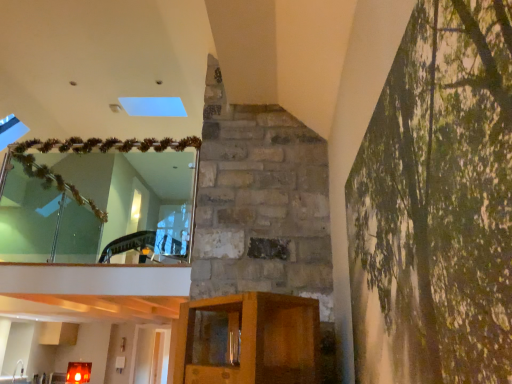
Image resolution: width=512 pixels, height=384 pixels. I want to click on clear glass mirror at upper left, so click(x=98, y=200).

Identify the location of brushed metal sink at lower left. The height and width of the screenshot is (384, 512). (16, 375).

Image resolution: width=512 pixels, height=384 pixels. I want to click on tree below the clear glass mirror at upper left (from the image's perspective), so click(x=437, y=204).

From the image's perspective, is clear glass mirror at upper left above or below green textured canvas at right?

clear glass mirror at upper left is above green textured canvas at right.

Is clear glass mirror at upper left touching green textured canvas at right?

No, clear glass mirror at upper left is not making contact with green textured canvas at right.

Considering the sizes of objects clear glass mirror at upper left and green textured canvas at right in the image provided, who is wider, clear glass mirror at upper left or green textured canvas at right?

clear glass mirror at upper left is wider.

Which of these two, green textured canvas at right or brushed metal sink at lower left, is thinner?

With smaller width is green textured canvas at right.

In the scene shown: How different are the orientations of green textured canvas at right and brushed metal sink at lower left in degrees?

The angle between the facing direction of green textured canvas at right and the facing direction of brushed metal sink at lower left is 139 degrees.

Is green textured canvas at right at the left side of brushed metal sink at lower left?

In fact, green textured canvas at right is to the right of brushed metal sink at lower left.

Could you tell me if brushed metal sink at lower left is facing clear glass mirror at upper left?

No, brushed metal sink at lower left does not turn towards clear glass mirror at upper left.

The height and width of the screenshot is (384, 512). Find the location of `window above the brushed metal sink at lower left (from a real-world perspective)`. window above the brushed metal sink at lower left (from a real-world perspective) is located at coordinates (98, 200).

Based on the photo, considering the sizes of objects brushed metal sink at lower left and clear glass mirror at upper left in the image provided, who is taller, brushed metal sink at lower left or clear glass mirror at upper left?

clear glass mirror at upper left.

Would you say brushed metal sink at lower left contains clear glass mirror at upper left?

No, clear glass mirror at upper left is not a part of brushed metal sink at lower left.

Looking at this image, who is shorter, green textured canvas at right or clear glass mirror at upper left?

With less height is green textured canvas at right.

This screenshot has height=384, width=512. Find the location of `window lying above the green textured canvas at right (from the image's perspective)`. window lying above the green textured canvas at right (from the image's perspective) is located at coordinates point(98,200).

Is green textured canvas at right oriented away from clear glass mirror at upper left?

No, green textured canvas at right's orientation is not away from clear glass mirror at upper left.

Is brushed metal sink at lower left not within green textured canvas at right?

brushed metal sink at lower left is positioned outside green textured canvas at right.

The image size is (512, 384). In order to click on tree on the right of brushed metal sink at lower left in this screenshot , I will do `click(437, 204)`.

Which point is more forward, (20, 362) or (450, 50)?

The point (450, 50) is in front.

Is brushed metal sink at lower left located within clear glass mirror at upper left?

No, clear glass mirror at upper left does not contain brushed metal sink at lower left.

From a real-world perspective, is clear glass mirror at upper left on brushed metal sink at lower left?

Yes, from a real-world perspective, clear glass mirror at upper left is above brushed metal sink at lower left.

Does clear glass mirror at upper left have a smaller size compared to brushed metal sink at lower left?

Incorrect, clear glass mirror at upper left is not smaller in size than brushed metal sink at lower left.

Relative to brushed metal sink at lower left, is clear glass mirror at upper left in front or behind?

clear glass mirror at upper left is positioned closer to the viewer than brushed metal sink at lower left.

I want to click on tree that appears on the right of clear glass mirror at upper left, so click(437, 204).

Locate an element on the screen. The width and height of the screenshot is (512, 384). sink behind the green textured canvas at right is located at coordinates (16, 375).

When comparing their distances from brushed metal sink at lower left, does clear glass mirror at upper left or green textured canvas at right seem closer?

clear glass mirror at upper left is positioned closer to the anchor brushed metal sink at lower left.

Considering their positions, is brushed metal sink at lower left positioned closer to green textured canvas at right than clear glass mirror at upper left?

Based on the image, clear glass mirror at upper left appears to be nearer to green textured canvas at right.

When comparing their distances from clear glass mirror at upper left, does brushed metal sink at lower left or green textured canvas at right seem further?

green textured canvas at right.

Estimate the real-world distances between objects in this image. Which object is closer to clear glass mirror at upper left, green textured canvas at right or brushed metal sink at lower left?

Based on the image, brushed metal sink at lower left appears to be nearer to clear glass mirror at upper left.

Considering their positions, is clear glass mirror at upper left positioned closer to green textured canvas at right than brushed metal sink at lower left?

clear glass mirror at upper left lies closer to green textured canvas at right than the other object.

Based on their spatial positions, is green textured canvas at right or clear glass mirror at upper left closer to brushed metal sink at lower left?

The object closer to brushed metal sink at lower left is clear glass mirror at upper left.

Identify the location of window positioned between green textured canvas at right and brushed metal sink at lower left from near to far. Image resolution: width=512 pixels, height=384 pixels. (98, 200).